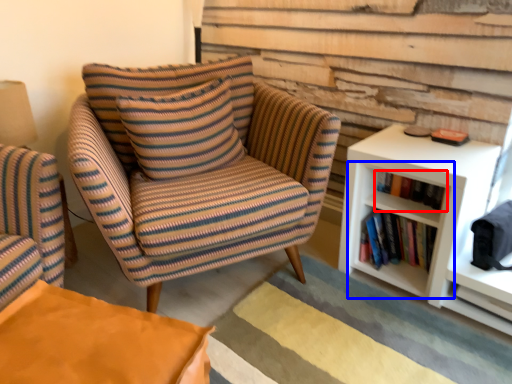
Question: Which object appears closest to the camera in this image, book (highlighted by a red box) or shelf (highlighted by a blue box)?

Choices:
 (A) book
 (B) shelf

Answer: (A)